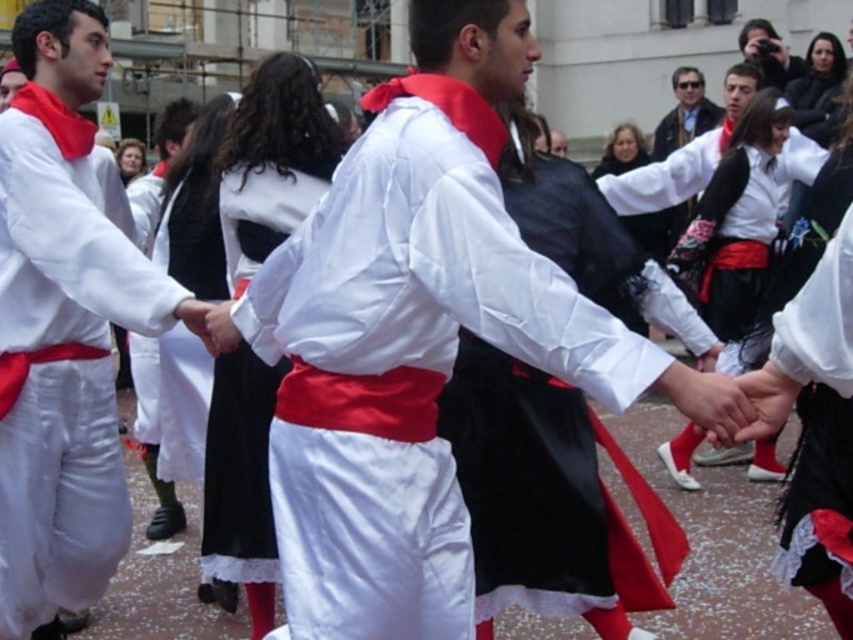
Which is more to the left, white satin shirt at center or white cotton shirt at center?

From the viewer's perspective, white cotton shirt at center appears more on the left side.

Between white satin shirt at center and white cotton shirt at center, which one has more height?

white cotton shirt at center is taller.

Between point (258, 269) and point (119, 452), which one is positioned behind?

The point (119, 452) is behind.

Locate an element on the screen. Image resolution: width=853 pixels, height=640 pixels. white satin shirt at center is located at coordinates (416, 339).

Which is above, white cotton shirt at center or matte black jacket at upper center?

matte black jacket at upper center is higher up.

Who is more forward, (x=134, y=324) or (x=664, y=150)?

Positioned in front is point (x=134, y=324).

Who is more distant from viewer, (76, 531) or (680, 109)?

The point (680, 109) is more distant.

Locate an element on the screen. The height and width of the screenshot is (640, 853). white cotton shirt at center is located at coordinates (62, 328).

Does white satin shirt at center have a lesser height compared to matte black camera at upper right?

No.

Which is more to the left, white satin shirt at center or matte black camera at upper right?

Positioned to the left is white satin shirt at center.

Does point (425, 481) come behind point (772, 65)?

No, it is in front of (772, 65).

You are a GUI agent. You are given a task and a screenshot of the screen. Output one action in this format:
    pyautogui.click(x=<x>, y=<y>)
    Task: Click on the white satin shirt at center
    
    Given the screenshot: What is the action you would take?
    pyautogui.click(x=416, y=339)